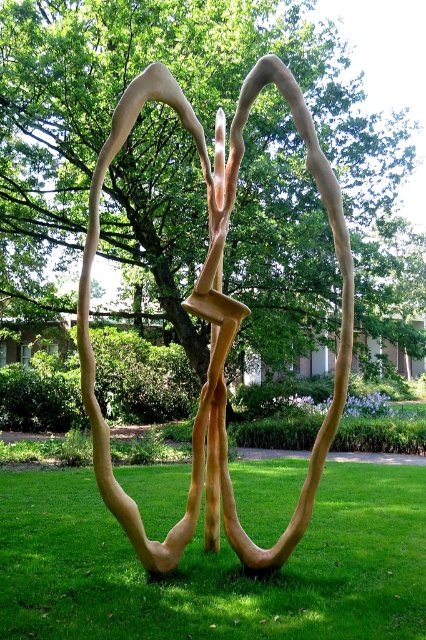
Is brown wood tree at center smaller than green grass at center?

Incorrect, brown wood tree at center is not smaller in size than green grass at center.

Which is in front, point (201, 376) or point (132, 627)?

Point (132, 627) is in front.

Which is in front, point (377, 268) or point (293, 490)?

Point (293, 490)

I want to click on brown wood tree at center, so click(198, 118).

Does point (250, 321) come farther from viewer compared to point (238, 324)?

Yes, it is.

In order to click on brown wood tree at center in this screenshot , I will do `click(198, 118)`.

Is green grass at center thinner than wooden sculpture at center?

Yes.

Does green grass at center appear under wooden sculpture at center?

Yes, green grass at center is below wooden sculpture at center.

Which is in front, point (348, 604) or point (95, 474)?

Point (348, 604) is more forward.

This screenshot has height=640, width=426. Find the location of `green grass at center`. green grass at center is located at coordinates (215, 566).